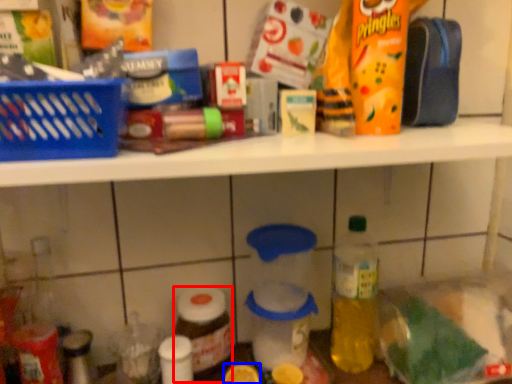
Question: Among these objects, which one is nearest to the camera, bottle (highlighted by a red box) or lemon (highlighted by a blue box)?

Choices:
 (A) bottle
 (B) lemon

Answer: (B)